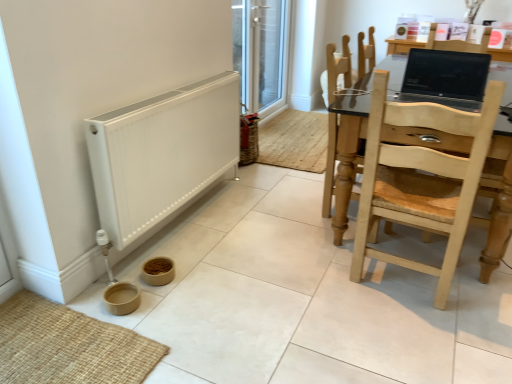
Question: Is light wood chair at right, the second chair from the back, smaller than matte black laptop at upper right?

Choices:
 (A) no
 (B) yes

Answer: (A)

Question: Is light wood chair at right, the second chair from the back, touching matte black laptop at upper right?

Choices:
 (A) no
 (B) yes

Answer: (A)

Question: From the image's perspective, is light wood chair at right, the second chair from the back, beneath matte black laptop at upper right?

Choices:
 (A) yes
 (B) no

Answer: (A)

Question: Can you confirm if light wood chair at right, the second chair from the back, is taller than matte black laptop at upper right?

Choices:
 (A) yes
 (B) no

Answer: (A)

Question: From the image's perspective, is light wood chair at right, the first chair in the front-to-back sequence, on top of matte black laptop at upper right?

Choices:
 (A) yes
 (B) no

Answer: (B)

Question: Is light wood chair at right, the second chair from the back, behind matte black laptop at upper right?

Choices:
 (A) yes
 (B) no

Answer: (B)

Question: From the image's perspective, is white matte heater at lower left located above light wood chair at right, the second chair from the back?

Choices:
 (A) yes
 (B) no

Answer: (A)

Question: Considering the relative positions of white matte heater at lower left and light wood chair at right, the second chair from the back, in the image provided, is white matte heater at lower left in front of light wood chair at right, the second chair from the back,?

Choices:
 (A) yes
 (B) no

Answer: (B)

Question: Could light wood chair at right, the second chair from the back, be considered to be inside white matte heater at lower left?

Choices:
 (A) yes
 (B) no

Answer: (B)

Question: Is white matte heater at lower left at the right side of light wood chair at right, the first chair in the front-to-back sequence?

Choices:
 (A) yes
 (B) no

Answer: (B)

Question: Is white matte heater at lower left shorter than light wood chair at right, the second chair from the back?

Choices:
 (A) no
 (B) yes

Answer: (B)

Question: Considering the relative positions of white matte heater at lower left and light wood chair at right, the second chair from the back, in the image provided, is white matte heater at lower left to the left of light wood chair at right, the second chair from the back, from the viewer's perspective?

Choices:
 (A) no
 (B) yes

Answer: (B)

Question: Can you confirm if light brown wooden chair at right, which is the 2th chair from front to back, is shorter than white matte heater at lower left?

Choices:
 (A) no
 (B) yes

Answer: (A)